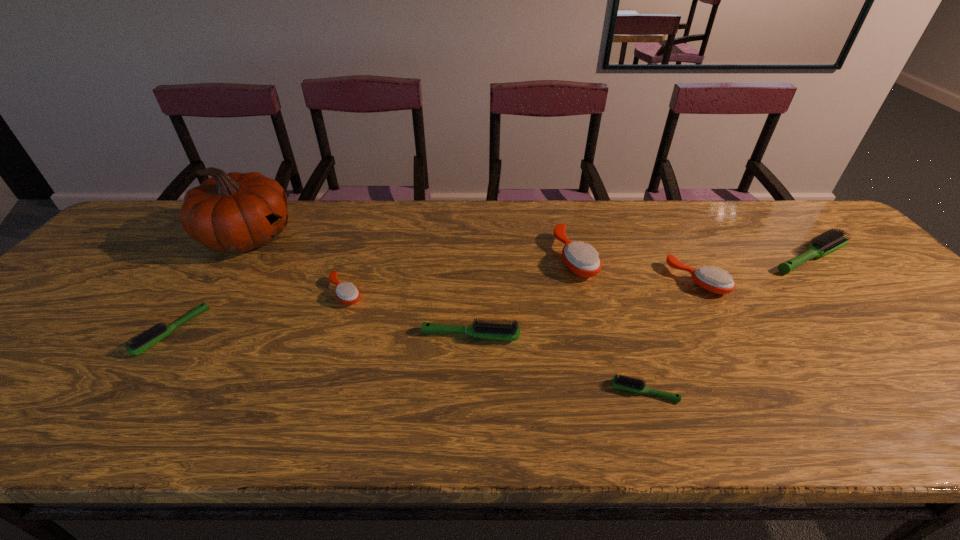
Identify the location of the leftmost orange hairbrush. This screenshot has width=960, height=540. (347, 293).

This screenshot has height=540, width=960. I want to click on the sixth object from right to left, so click(x=347, y=293).

At what (x,y) coordinates should I click in order to perform the action: click on the leftmost hairbrush. Please return your answer as a coordinate pair (x, y). The width and height of the screenshot is (960, 540). Looking at the image, I should click on (145, 340).

Identify the location of the second smallest light hairbrush. This screenshot has width=960, height=540. (145, 340).

I want to click on the smallest light hairbrush, so click(622, 382).

Find the location of a particular element. The width and height of the screenshot is (960, 540). the nearest object is located at coordinates (622, 382).

Image resolution: width=960 pixels, height=540 pixels. I want to click on free space located 0.150m on the face of the tallest object, so click(346, 237).

I want to click on blank area located on the left of the second tallest object, so click(513, 257).

You are a GUI agent. You are given a task and a screenshot of the screen. Output one action in this format:
    pyautogui.click(x=<x>, y=<y>)
    Task: Click on the free space located on the front of the rightmost orange hairbrush
    The height and width of the screenshot is (540, 960).
    Given the screenshot: What is the action you would take?
    pyautogui.click(x=723, y=326)

Locate an element on the screen. Image resolution: width=960 pixels, height=540 pixels. free space located on the front of the biggest light hairbrush is located at coordinates (839, 289).